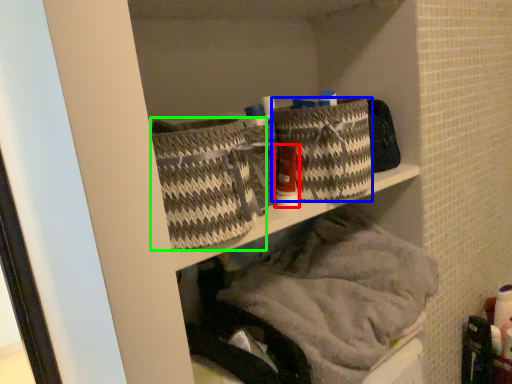
Question: Which object is the closest to the toiletry (highlighted by a red box)? Choose among these: basket (highlighted by a blue box) or basket (highlighted by a green box).

Choices:
 (A) basket
 (B) basket

Answer: (A)